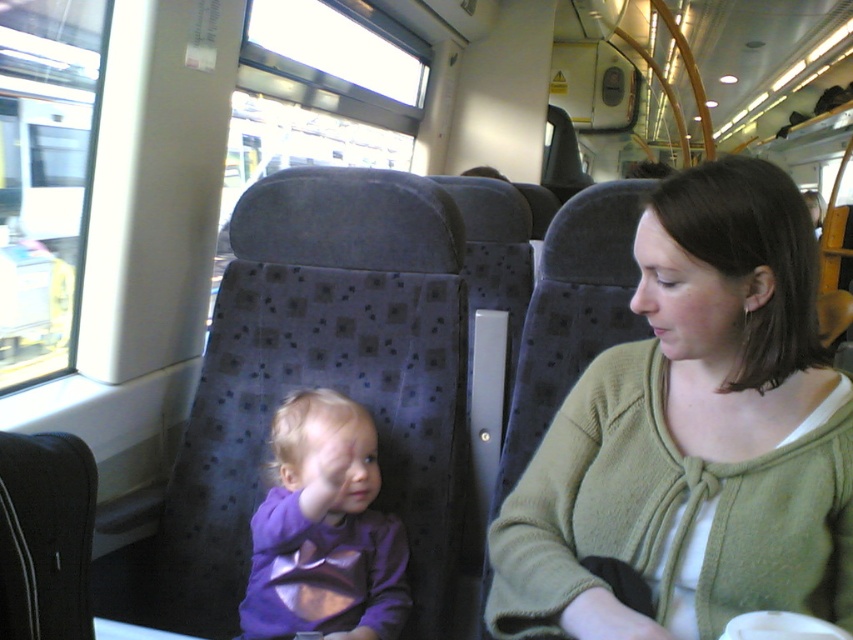
You are a passenger on the train and want to know if the green knit cardigan at center can be folded and placed into the purple fabric baby at center. Based on their sizes, is this possible?

The green knit cardigan at center is bigger than the purple fabric baby at center, so it cannot be folded and placed into the purple fabric baby at center.